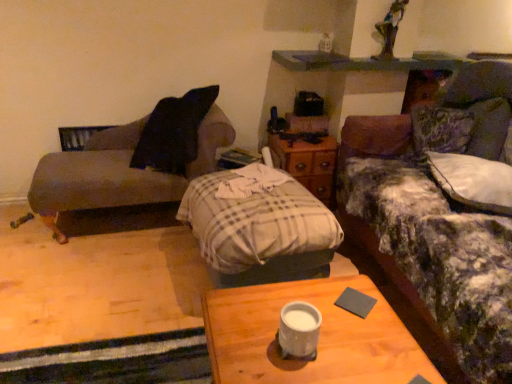
Where is `empty space that is ontop of wooden desk at center (from a real-world perspective)`? This screenshot has height=384, width=512. empty space that is ontop of wooden desk at center (from a real-world perspective) is located at coordinates (292, 349).